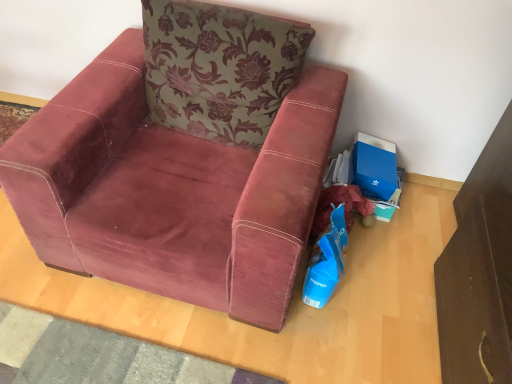
Find the location of a particular element. The width and height of the screenshot is (512, 384). blue cardboard box at lower right is located at coordinates (374, 166).

What is the approximate height of green floral fabric pillow at upper center?

18.71 inches.

The height and width of the screenshot is (384, 512). What are the coordinates of `blue plastic shopping bag at lower right` in the screenshot? It's located at (326, 262).

This screenshot has height=384, width=512. Describe the element at coordinates (326, 262) in the screenshot. I see `blue plastic shopping bag at lower right` at that location.

Identify the location of velvet maroon armchair at center. (170, 190).

Locate an element on the screen. Image resolution: width=512 pixels, height=384 pixels. blue cardboard box at lower right is located at coordinates (374, 166).

Would you consider blue plastic shopping bag at lower right to be distant from green floral fabric pillow at upper center?

No, blue plastic shopping bag at lower right is not far from green floral fabric pillow at upper center.

Is blue plastic shopping bag at lower right bigger or smaller than green floral fabric pillow at upper center?

In the image, blue plastic shopping bag at lower right appears to be smaller than green floral fabric pillow at upper center.

Between blue plastic shopping bag at lower right and green floral fabric pillow at upper center, which one has more height?

green floral fabric pillow at upper center.

In the scene shown: Which object is more forward, blue plastic shopping bag at lower right or green floral fabric pillow at upper center?

green floral fabric pillow at upper center is closer to the camera.

In the image, is velvet maroon armchair at center positioned in front of or behind green floral fabric pillow at upper center?

velvet maroon armchair at center is positioned closer to the viewer than green floral fabric pillow at upper center.

From the picture: From the image's perspective, does velvet maroon armchair at center appear higher than green floral fabric pillow at upper center?

No, from the image's perspective, velvet maroon armchair at center is not on top of green floral fabric pillow at upper center.

In terms of width, does velvet maroon armchair at center look wider or thinner when compared to green floral fabric pillow at upper center?

In the image, velvet maroon armchair at center appears to be wider than green floral fabric pillow at upper center.

Does blue plastic shopping bag at lower right have a lesser height compared to blue cardboard box at lower right?

In fact, blue plastic shopping bag at lower right may be taller than blue cardboard box at lower right.

Between blue plastic shopping bag at lower right and blue cardboard box at lower right, which one is positioned in front?

blue plastic shopping bag at lower right is closer to the camera.

Does blue plastic shopping bag at lower right appear on the right side of blue cardboard box at lower right?

No, blue plastic shopping bag at lower right is not to the right of blue cardboard box at lower right.

From the image's perspective, which one is positioned lower, blue plastic shopping bag at lower right or blue cardboard box at lower right?

blue plastic shopping bag at lower right is shown below in the image.

Would you say velvet maroon armchair at center contains blue cardboard box at lower right?

No, blue cardboard box at lower right is not inside velvet maroon armchair at center.

From the image's perspective, between velvet maroon armchair at center and blue cardboard box at lower right, which one is located above?

velvet maroon armchair at center.

Does velvet maroon armchair at center touch blue cardboard box at lower right?

There is a gap between velvet maroon armchair at center and blue cardboard box at lower right.

Consider the image. How distant is velvet maroon armchair at center from blue cardboard box at lower right?

velvet maroon armchair at center is 31.73 inches from blue cardboard box at lower right.

From the image's perspective, is green floral fabric pillow at upper center below blue plastic shopping bag at lower right?

Incorrect, from the image's perspective, green floral fabric pillow at upper center is higher than blue plastic shopping bag at lower right.

From a real-world perspective, which is physically above, green floral fabric pillow at upper center or blue plastic shopping bag at lower right?

green floral fabric pillow at upper center, from a real-world perspective.

Which is behind, green floral fabric pillow at upper center or blue plastic shopping bag at lower right?

blue plastic shopping bag at lower right is further away from the camera.

Can you confirm if blue cardboard box at lower right is wider than velvet maroon armchair at center?

No.

From the image's perspective, between blue cardboard box at lower right and velvet maroon armchair at center, which one is located above?

velvet maroon armchair at center.

Does blue cardboard box at lower right have a smaller size compared to velvet maroon armchair at center?

Yes.

How many degrees apart are the facing directions of blue cardboard box at lower right and velvet maroon armchair at center?

The angle between the facing direction of blue cardboard box at lower right and the facing direction of velvet maroon armchair at center is 4.03 degrees.

From the image's perspective, is green floral fabric pillow at upper center on top of blue cardboard box at lower right?

Yes, from the image's perspective, green floral fabric pillow at upper center is above blue cardboard box at lower right.

Considering the points (237, 14) and (389, 163), which point is in front, point (237, 14) or point (389, 163)?

The point (237, 14) is closer to the camera.

Who is bigger, green floral fabric pillow at upper center or blue cardboard box at lower right?

With larger size is green floral fabric pillow at upper center.

Is green floral fabric pillow at upper center facing away from blue cardboard box at lower right?

No, green floral fabric pillow at upper center is not facing the opposite direction of blue cardboard box at lower right.

Find the location of a particular element. The height and width of the screenshot is (384, 512). pillow in front of the blue plastic shopping bag at lower right is located at coordinates (219, 68).

The image size is (512, 384). Find the location of `pillow located on the right of velvet maroon armchair at center`. pillow located on the right of velvet maroon armchair at center is located at coordinates (219, 68).

When comparing their distances from green floral fabric pillow at upper center, does velvet maroon armchair at center or blue cardboard box at lower right seem further?

blue cardboard box at lower right is further to green floral fabric pillow at upper center.

Based on their spatial positions, is velvet maroon armchair at center or blue plastic shopping bag at lower right closer to green floral fabric pillow at upper center?

velvet maroon armchair at center lies closer to green floral fabric pillow at upper center than the other object.

Which object lies further to the anchor point blue cardboard box at lower right, velvet maroon armchair at center or green floral fabric pillow at upper center?

The object further to blue cardboard box at lower right is velvet maroon armchair at center.

Looking at the image, which one is located further to velvet maroon armchair at center, blue plastic shopping bag at lower right or blue cardboard box at lower right?

blue cardboard box at lower right lies further to velvet maroon armchair at center than the other object.

In the scene shown: Which object lies further to the anchor point green floral fabric pillow at upper center, blue plastic shopping bag at lower right or blue cardboard box at lower right?

Based on the image, blue cardboard box at lower right appears to be further to green floral fabric pillow at upper center.

When comparing their distances from blue cardboard box at lower right, does blue plastic shopping bag at lower right or velvet maroon armchair at center seem further?

Among the two, velvet maroon armchair at center is located further to blue cardboard box at lower right.

When comparing their distances from velvet maroon armchair at center, does blue cardboard box at lower right or blue plastic shopping bag at lower right seem further?

Among the two, blue cardboard box at lower right is located further to velvet maroon armchair at center.

When comparing their distances from blue plastic shopping bag at lower right, does blue cardboard box at lower right or velvet maroon armchair at center seem further?

The object further to blue plastic shopping bag at lower right is velvet maroon armchair at center.

This screenshot has height=384, width=512. Find the location of `shopping bag between velvet maroon armchair at center and blue cardboard box at lower right along the z-axis`. shopping bag between velvet maroon armchair at center and blue cardboard box at lower right along the z-axis is located at coordinates (326, 262).

Find the location of `pillow located between velvet maroon armchair at center and blue cardboard box at lower right in the left-right direction`. pillow located between velvet maroon armchair at center and blue cardboard box at lower right in the left-right direction is located at coordinates (219, 68).

Locate an element on the screen. This screenshot has height=384, width=512. storage box between green floral fabric pillow at upper center and blue plastic shopping bag at lower right in the up-down direction is located at coordinates (374, 166).

Identify the location of chair that lies between green floral fabric pillow at upper center and blue plastic shopping bag at lower right from top to bottom. (170, 190).